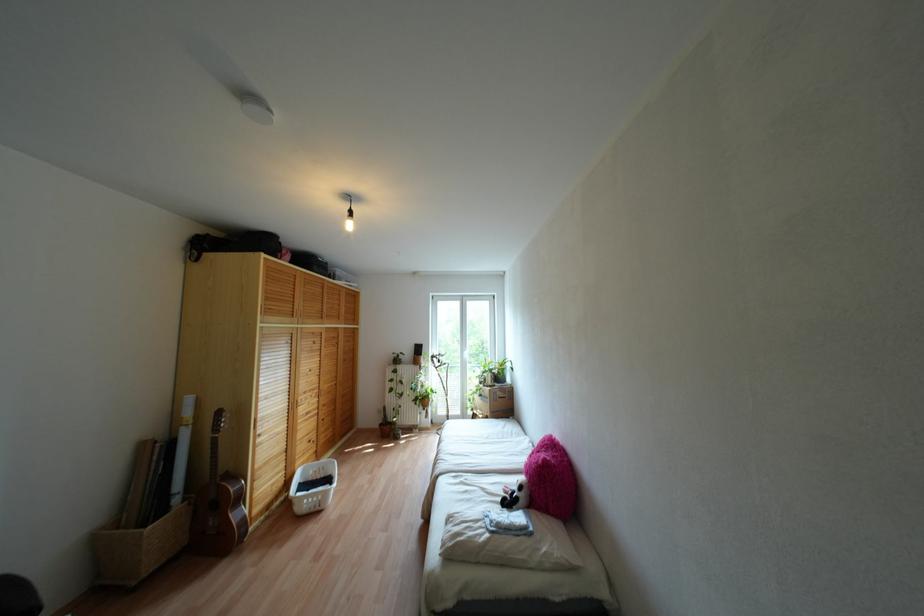
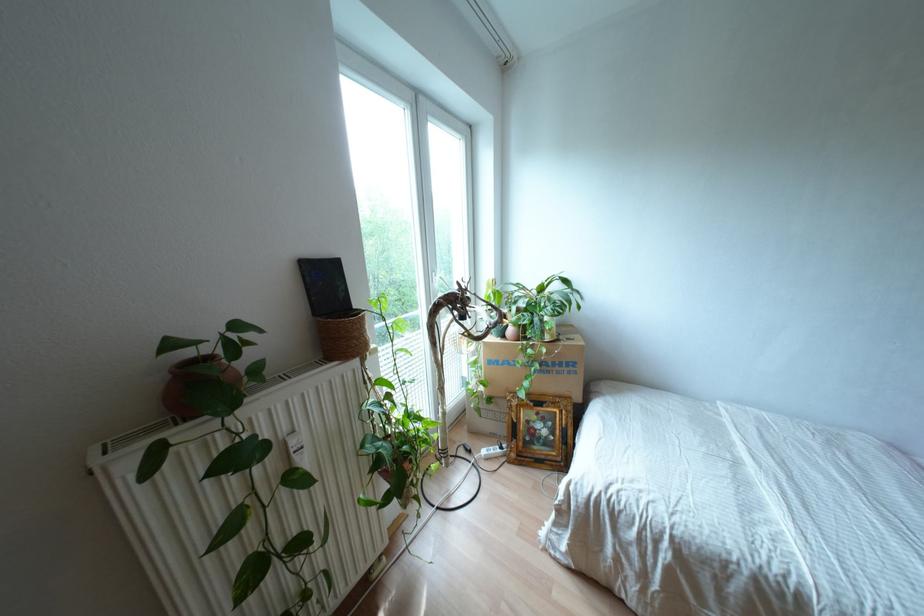
Where in the second image is the point corresponding to [420,345] from the first image?

(334, 262)